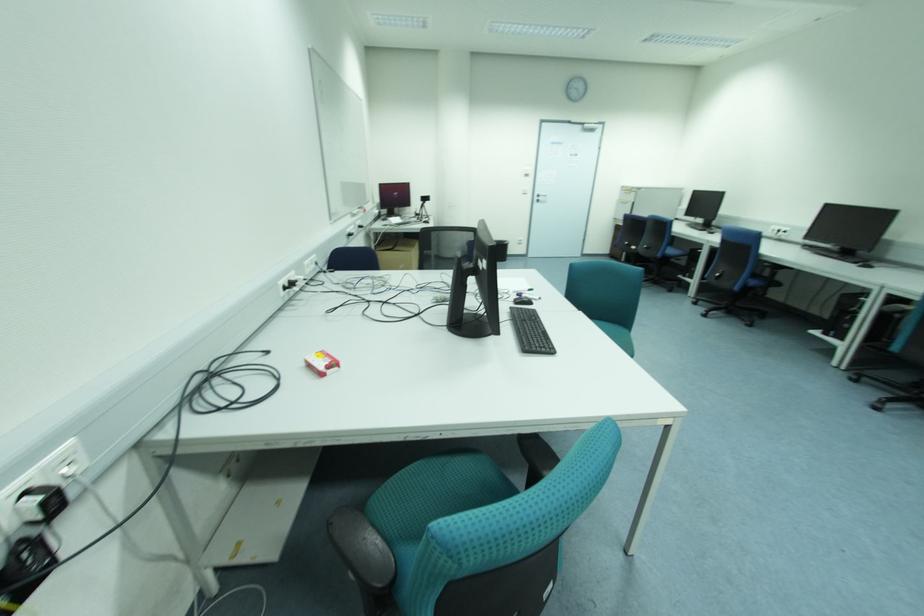
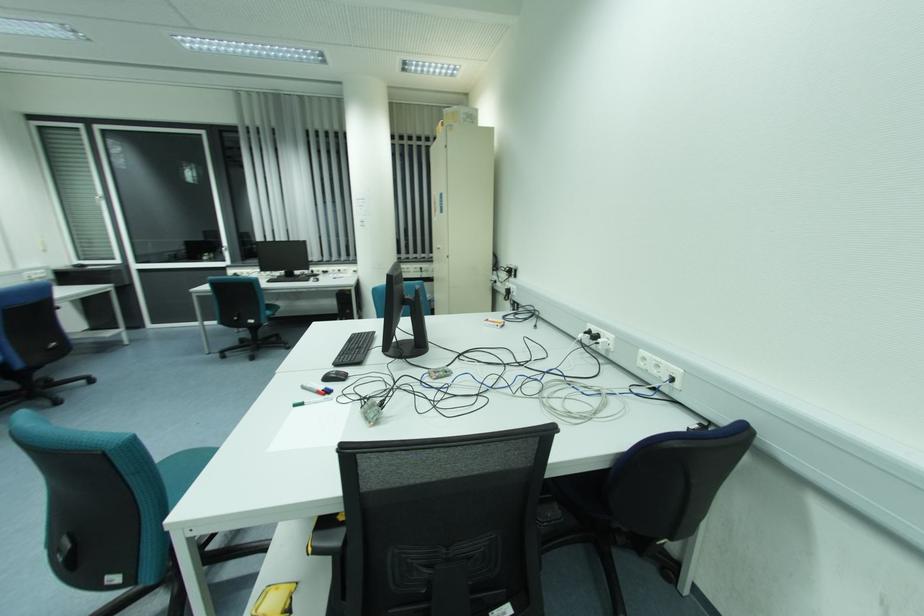
Where in the second image is the point corresponding to [306,262] from the first image?

(642, 352)